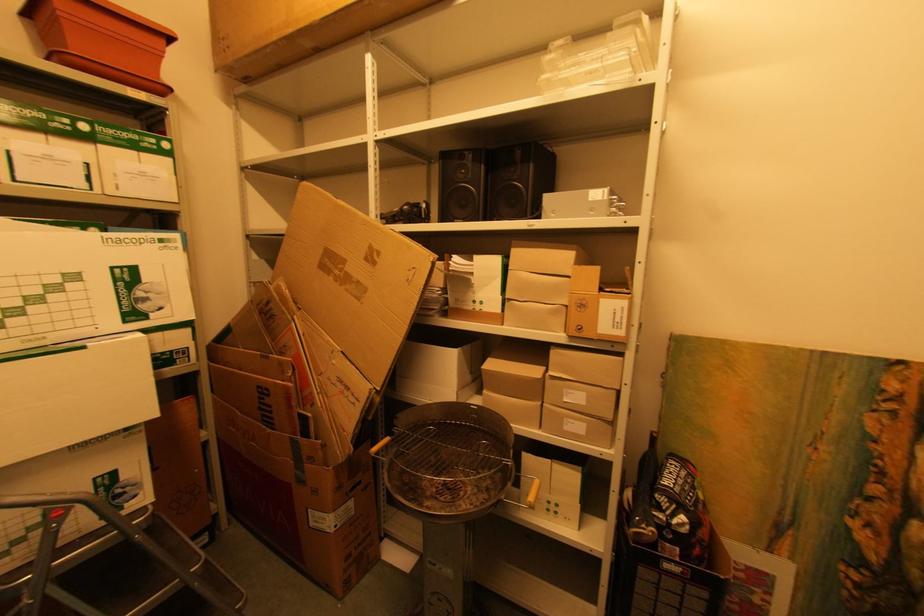
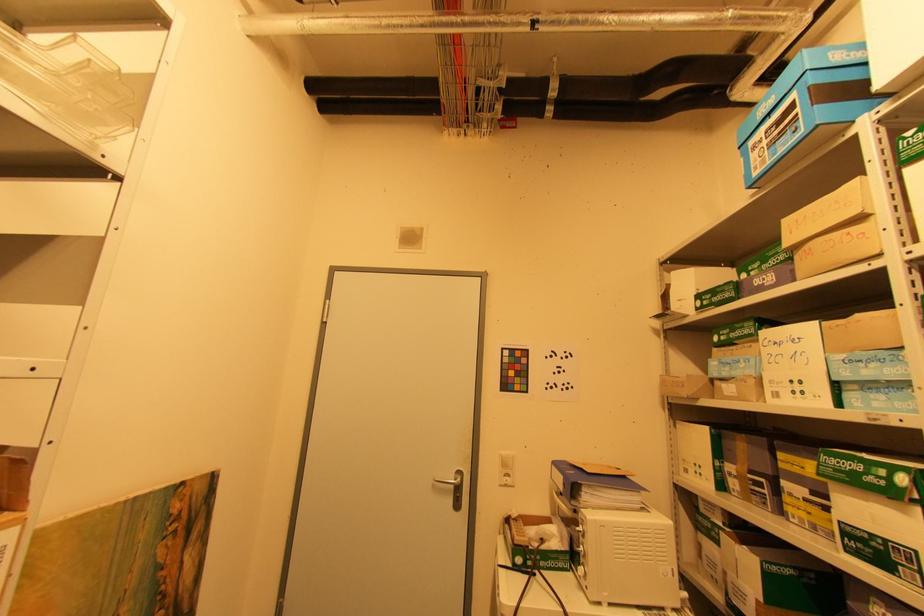
Question: Based on the continuous images, in which direction is the camera rotating? Reply with the corresponding letter.

Choices:
 (A) Left
 (B) Right
 (C) Up
 (D) Down

Answer: (B)